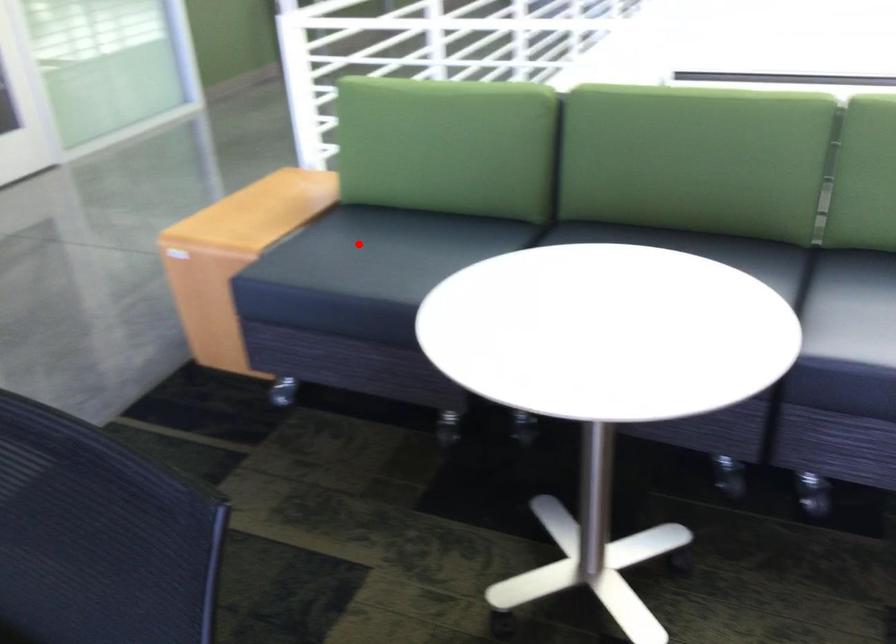
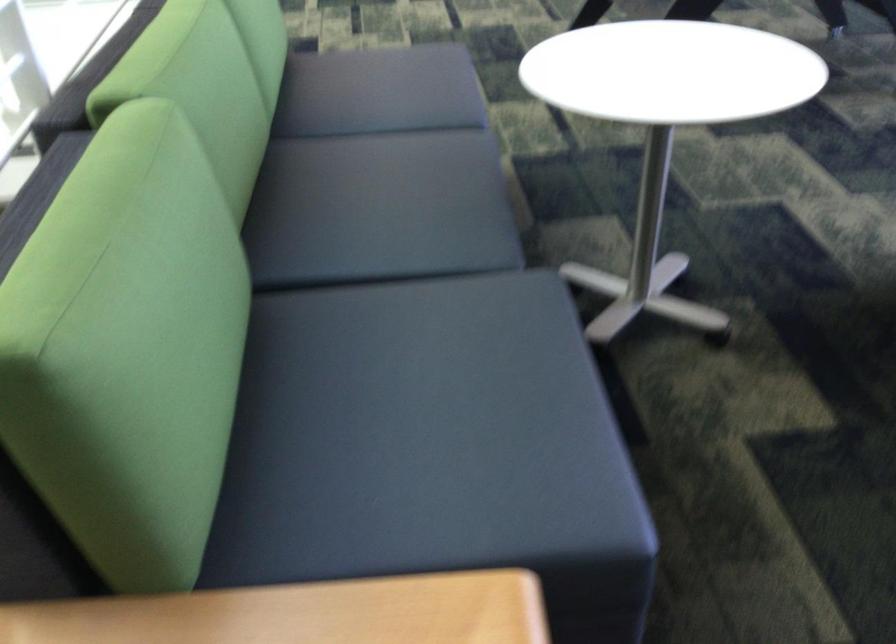
Question: I am providing you with two images of the same scene from different viewpoints. A red point is marked on the first image. Can you still see the location of the red point in image 2?

Choices:
 (A) Yes
 (B) No

Answer: (A)